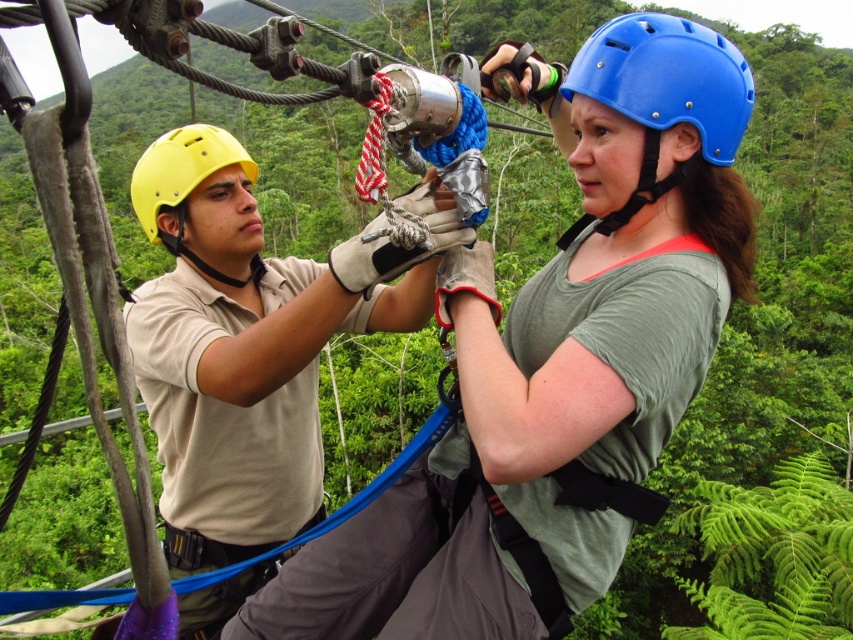
Which is below, matte khaki shirt at center or blue hard plastic helmet at center?

matte khaki shirt at center is lower down.

Between point (303, 346) and point (630, 16), which one is positioned behind?

Positioned behind is point (303, 346).

Where is `matte khaki shirt at center`? This screenshot has height=640, width=853. matte khaki shirt at center is located at coordinates coord(242,348).

Describe the element at coordinates (242, 348) in the screenshot. I see `matte khaki shirt at center` at that location.

Which is behind, point (279, 456) or point (219, 132)?

Point (279, 456)

Describe the element at coordinates (242, 348) in the screenshot. I see `matte khaki shirt at center` at that location.

Where is `matte khaki shirt at center`? Image resolution: width=853 pixels, height=640 pixels. matte khaki shirt at center is located at coordinates (242, 348).

Is blue hard plastic helmet at center smaller than yellow matte helmet at upper left?

Correct, blue hard plastic helmet at center occupies less space than yellow matte helmet at upper left.

Locate an element on the screen. Image resolution: width=853 pixels, height=640 pixels. blue hard plastic helmet at center is located at coordinates (664, 93).

Is point (724, 90) behind point (169, 140)?

No, (724, 90) is closer to viewer.

What are the coordinates of `blue hard plastic helmet at center` in the screenshot? It's located at (664, 93).